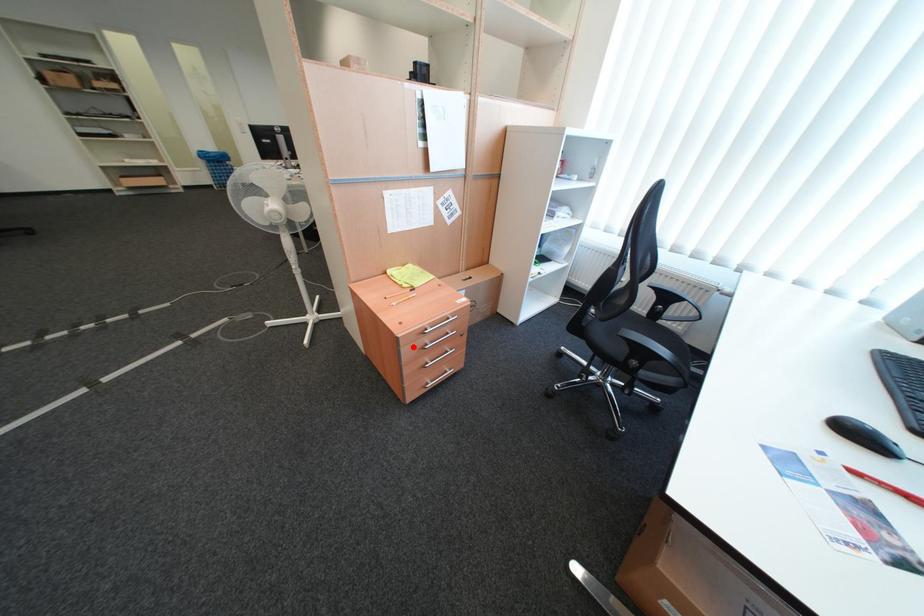
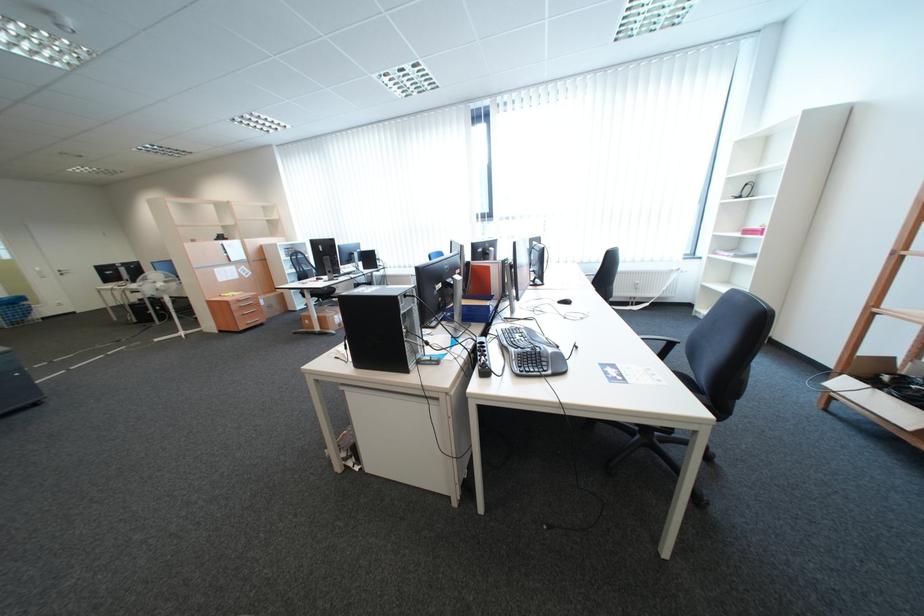
Question: I am providing you with two images of the same scene from different viewpoints. A red point is marked on the first image. Is the red point's position out of view in image 2?

Choices:
 (A) Yes
 (B) No

Answer: (B)